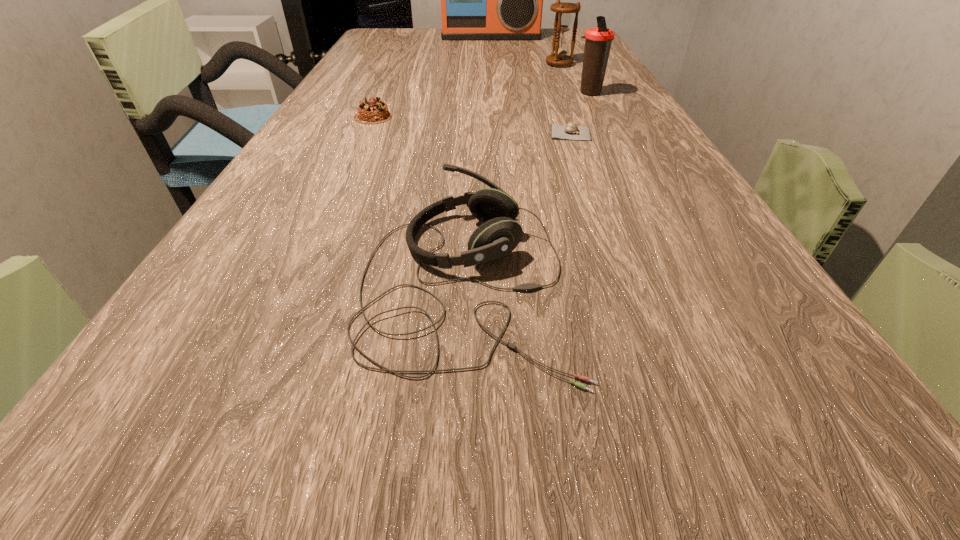
Locate an element on the screen. The image size is (960, 540). free spot between the thermos bottle and the tallest object is located at coordinates (540, 65).

Where is `free space between the second farthest object and the farthest object`? The height and width of the screenshot is (540, 960). free space between the second farthest object and the farthest object is located at coordinates (525, 50).

Locate an element on the screen. Image resolution: width=960 pixels, height=540 pixels. free spot between the fifth farthest object and the second farthest object is located at coordinates (565, 98).

Where is `free area in between the hourglass and the second shortest object`? free area in between the hourglass and the second shortest object is located at coordinates (467, 90).

At what (x,y) coordinates should I click in order to perform the action: click on blank region between the hourglass and the third shortest object. Please return your answer as a coordinate pair (x, y). The width and height of the screenshot is (960, 540). Looking at the image, I should click on (514, 173).

I want to click on empty space that is in between the farthest object and the hourglass, so click(525, 50).

The image size is (960, 540). I want to click on empty space between the third farthest object and the farthest object, so click(x=540, y=65).

At what (x,y) coordinates should I click in order to perform the action: click on free space between the tallest object and the second nearest object. Please return your answer as a coordinate pair (x, y). The image size is (960, 540). Looking at the image, I should click on (531, 85).

Where is `object that is the fourth closest to the hourglass`? The width and height of the screenshot is (960, 540). object that is the fourth closest to the hourglass is located at coordinates (375, 111).

The width and height of the screenshot is (960, 540). Identify the location of object that is the second closest to the fourth tallest object. (375, 111).